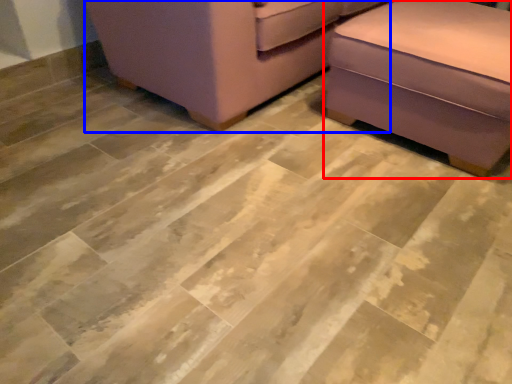
Question: Which object appears closest to the camera in this image, furniture (highlighted by a red box) or furniture (highlighted by a blue box)?

Choices:
 (A) furniture
 (B) furniture

Answer: (A)